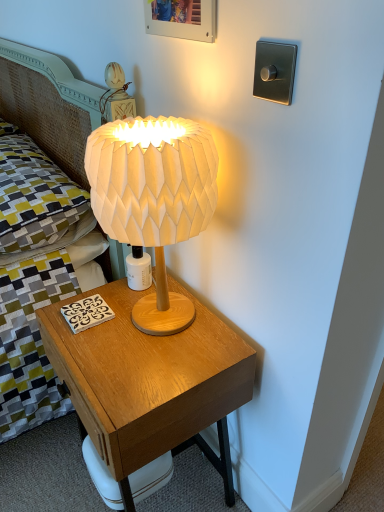
In order to face wooden picture frame at upper center, should I rotate leftwards or rightwards?

Turn left by 2.501 degrees to look at wooden picture frame at upper center.

Describe the element at coordinates (36, 201) in the screenshot. The width and height of the screenshot is (384, 512). I see `yellow-green fabric pillow at upper left` at that location.

The width and height of the screenshot is (384, 512). What are the coordinates of `wooden nightstand at center` in the screenshot? It's located at (149, 383).

Is wooden nightstand at center wider or thinner than wooden picture frame at upper center?

In the image, wooden nightstand at center appears to be wider than wooden picture frame at upper center.

From the image's perspective, is wooden nightstand at center located above or below wooden picture frame at upper center?

Clearly, from the image's perspective, wooden nightstand at center is below wooden picture frame at upper center.

Considering the relative positions of wooden nightstand at center and wooden picture frame at upper center in the image provided, is wooden nightstand at center behind wooden picture frame at upper center?

Yes, it is behind wooden picture frame at upper center.

Measure the distance from wooden nightstand at center to wooden picture frame at upper center.

wooden nightstand at center is 27.68 inches away from wooden picture frame at upper center.

Measure the distance between wooden picture frame at upper center and wooden nightstand at center.

A distance of 27.68 inches exists between wooden picture frame at upper center and wooden nightstand at center.

Is wooden picture frame at upper center beside wooden nightstand at center?

wooden picture frame at upper center and wooden nightstand at center are clearly separated.

Who is more distant, wooden picture frame at upper center or wooden nightstand at center?

wooden nightstand at center is more distant.

Which is less distant, (x=174, y=28) or (x=173, y=406)?

Point (x=174, y=28) is closer to the camera than point (x=173, y=406).

Can you confirm if yellow-green fabric pillow at upper left is wider than white paper lampshade at center?

Indeed, yellow-green fabric pillow at upper left has a greater width compared to white paper lampshade at center.

Which is in front, point (15, 178) or point (187, 122)?

The point (187, 122) is closer.

Between yellow-green fabric pillow at upper left and white paper lampshade at center, which one has larger size?

yellow-green fabric pillow at upper left.

The width and height of the screenshot is (384, 512). Identify the location of pillow on the left of white paper lampshade at center. (36, 201).

Between wooden nightstand at center and yellow-green fabric pillow at upper left, which one has more height?

With more height is wooden nightstand at center.

How many degrees apart are the facing directions of wooden nightstand at center and yellow-green fabric pillow at upper left?

They differ by 0.645 degrees in their facing directions.

Is wooden nightstand at center bigger than yellow-green fabric pillow at upper left?

Indeed, wooden nightstand at center has a larger size compared to yellow-green fabric pillow at upper left.

Who is more distant, wooden nightstand at center or yellow-green fabric pillow at upper left?

Positioned behind is yellow-green fabric pillow at upper left.

Is wooden picture frame at upper center facing away from white paper lampshade at center?

No, white paper lampshade at center is not at the back of wooden picture frame at upper center.

Does wooden picture frame at upper center appear on the right side of white paper lampshade at center?

Yes, wooden picture frame at upper center is to the right of white paper lampshade at center.

From a real-world perspective, is wooden picture frame at upper center positioned above or below white paper lampshade at center?

In terms of real-world spatial position, wooden picture frame at upper center is above white paper lampshade at center.

How different are the orientations of wooden picture frame at upper center and yellow-green fabric pillow at upper left in degrees?

wooden picture frame at upper center and yellow-green fabric pillow at upper left are facing 0.903 degrees away from each other.

Does wooden picture frame at upper center turn towards yellow-green fabric pillow at upper left?

No, wooden picture frame at upper center is not aimed at yellow-green fabric pillow at upper left.

From the image's perspective, is wooden picture frame at upper center under yellow-green fabric pillow at upper left?

Actually, wooden picture frame at upper center appears above yellow-green fabric pillow at upper left in the image.

Does wooden picture frame at upper center have a greater width compared to yellow-green fabric pillow at upper left?

In fact, wooden picture frame at upper center might be narrower than yellow-green fabric pillow at upper left.

Measure the distance between white paper lampshade at center and wooden picture frame at upper center.

white paper lampshade at center is 12.16 inches away from wooden picture frame at upper center.

Is white paper lampshade at center aimed at wooden picture frame at upper center?

No, white paper lampshade at center does not turn towards wooden picture frame at upper center.

In the scene shown: Which is correct: white paper lampshade at center is inside wooden picture frame at upper center, or outside of it?

white paper lampshade at center lies outside wooden picture frame at upper center.

Considering the relative sizes of white paper lampshade at center and wooden picture frame at upper center in the image provided, is white paper lampshade at center thinner than wooden picture frame at upper center?

No, white paper lampshade at center is not thinner than wooden picture frame at upper center.

Identify the location of nightstand beneath the wooden picture frame at upper center (from a real-world perspective). This screenshot has width=384, height=512. (149, 383).

Identify the location of picture frame lying above the wooden nightstand at center (from the image's perspective). This screenshot has height=512, width=384. (182, 19).

Which object lies nearer to the anchor point white paper lampshade at center, yellow-green fabric pillow at upper left or wooden nightstand at center?

Based on the image, wooden nightstand at center appears to be nearer to white paper lampshade at center.

Estimate the real-world distances between objects in this image. Which object is closer to wooden picture frame at upper center, white paper lampshade at center or yellow-green fabric pillow at upper left?

white paper lampshade at center is closer to wooden picture frame at upper center.

From the image, which object appears to be nearer to white paper lampshade at center, yellow-green fabric pillow at upper left or wooden picture frame at upper center?

The object closer to white paper lampshade at center is wooden picture frame at upper center.

Looking at the image, which one is located closer to wooden picture frame at upper center, yellow-green fabric pillow at upper left or white paper lampshade at center?

The object closer to wooden picture frame at upper center is white paper lampshade at center.

Based on the photo, considering their positions, is white paper lampshade at center positioned further to yellow-green fabric pillow at upper left than wooden nightstand at center?

The object further to yellow-green fabric pillow at upper left is white paper lampshade at center.

Based on the photo, when comparing their distances from yellow-green fabric pillow at upper left, does wooden picture frame at upper center or wooden nightstand at center seem further?

wooden picture frame at upper center is positioned further to the anchor yellow-green fabric pillow at upper left.

Estimate the real-world distances between objects in this image. Which object is closer to wooden nightstand at center, white paper lampshade at center or yellow-green fabric pillow at upper left?

white paper lampshade at center.

Estimate the real-world distances between objects in this image. Which object is closer to white paper lampshade at center, wooden nightstand at center or wooden picture frame at upper center?

wooden nightstand at center is closer to white paper lampshade at center.

Locate an element on the screen. pillow between wooden picture frame at upper center and wooden nightstand at center vertically is located at coordinates (36, 201).

At what (x,y) coordinates should I click in order to perform the action: click on lamp between wooden picture frame at upper center and wooden nightstand at center vertically. Please return your answer as a coordinate pair (x, y). Image resolution: width=384 pixels, height=512 pixels. Looking at the image, I should click on (154, 199).

Where is `lamp between yellow-green fabric pillow at upper left and wooden picture frame at upper center`? lamp between yellow-green fabric pillow at upper left and wooden picture frame at upper center is located at coordinates (154, 199).

Find the location of a particular element. lamp between yellow-green fabric pillow at upper left and wooden nightstand at center in the up-down direction is located at coordinates (154, 199).